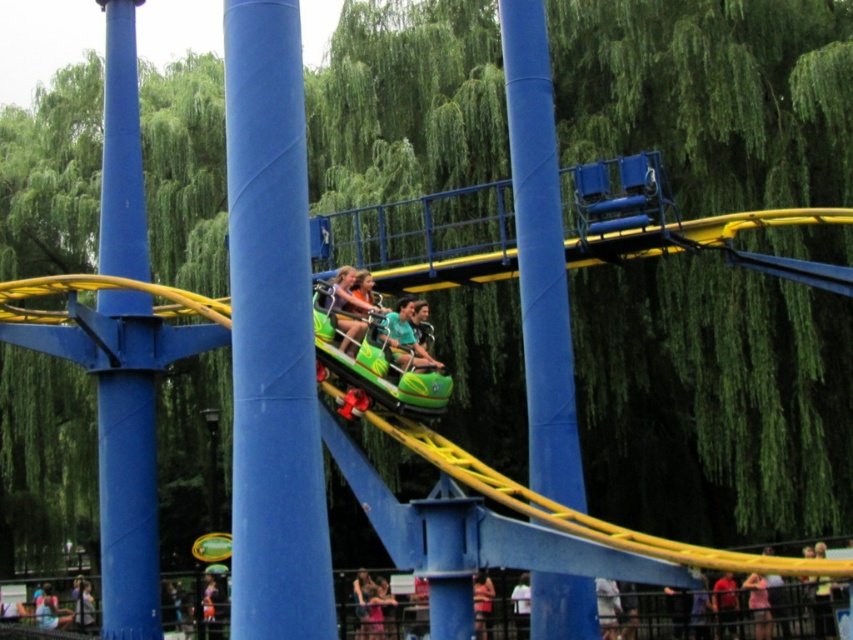
Question: Which point appears farthest from the camera in this image?

Choices:
 (A) (260, 570)
 (B) (316, 336)
 (C) (410, 360)
 (D) (476, 580)

Answer: (D)

Question: Which point appears closest to the camera in this image?

Choices:
 (A) (x=370, y=353)
 (B) (x=131, y=474)
 (C) (x=527, y=72)

Answer: (A)

Question: Among these objects, which one is nearest to the camera?

Choices:
 (A) green plastic helmet at center
 (B) blue glossy pole at center

Answer: (B)

Question: Can you confirm if green matte roller coaster car at center is smaller than matte pink shirt at center?

Choices:
 (A) no
 (B) yes

Answer: (B)

Question: Can you confirm if green matte roller coaster car at center is positioned below matte pink shirt at center?

Choices:
 (A) yes
 (B) no

Answer: (B)

Question: Where is blue metallic pole at left located in relation to matte pink shirt at center in the image?

Choices:
 (A) above
 (B) below

Answer: (A)